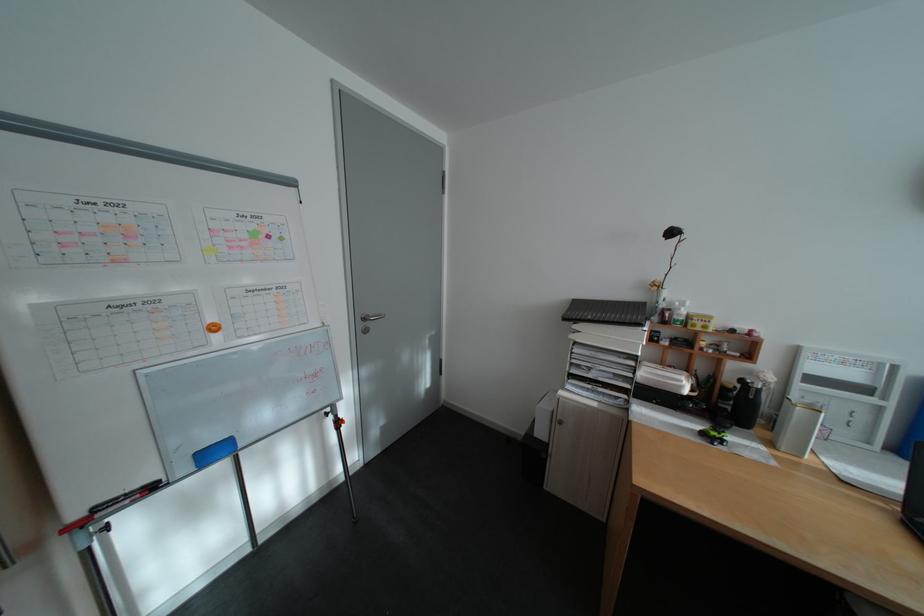
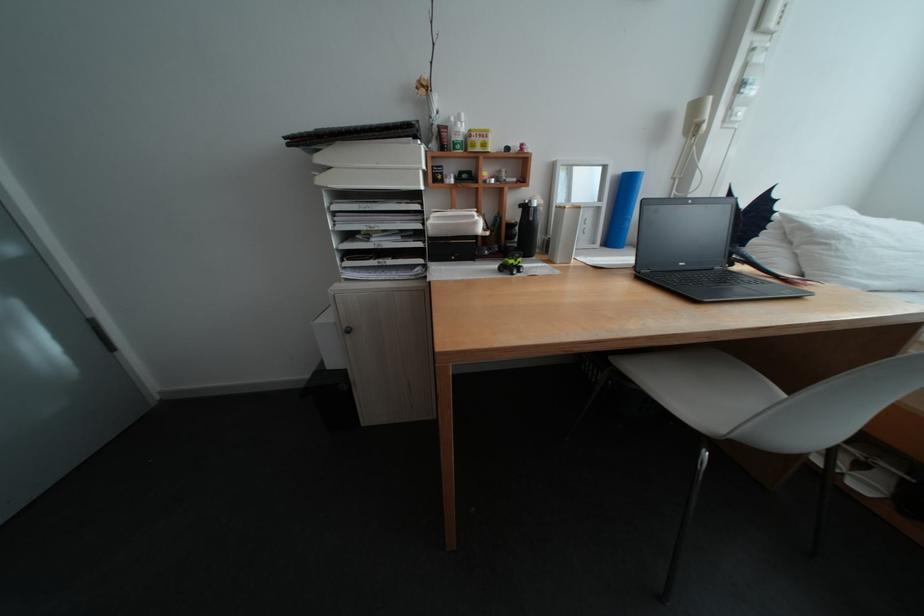
Where in the second image is the point corresponding to [710,435] from the first image?

(511, 272)